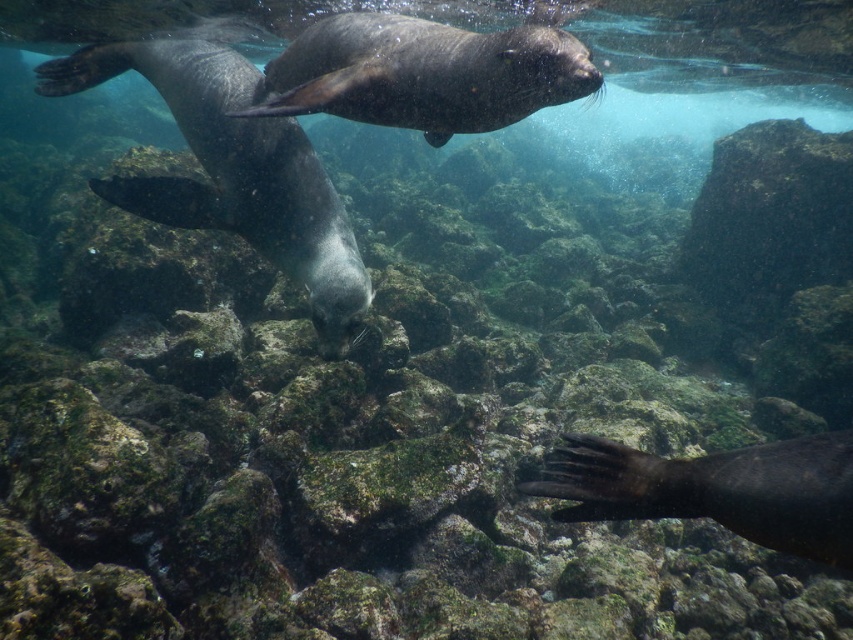
Consider the image. Is shiny dark fur seal at upper center above green mossy rock at upper right?

No, shiny dark fur seal at upper center is not above green mossy rock at upper right.

In the scene shown: Is shiny dark fur seal at upper center further to the viewer compared to green mossy rock at upper right?

No, it is in front of green mossy rock at upper right.

Is point (495, 33) positioned in front of point (801, 128)?

That is True.

What are the coordinates of `shiny dark fur seal at upper center` in the screenshot? It's located at (422, 74).

What do you see at coordinates (234, 172) in the screenshot?
I see `shiny gray seal at center` at bounding box center [234, 172].

Who is higher up, shiny gray seal at center or green mossy rock at upper right?

green mossy rock at upper right is higher up.

This screenshot has height=640, width=853. What do you see at coordinates (234, 172) in the screenshot?
I see `shiny gray seal at center` at bounding box center [234, 172].

At what (x,y) coordinates should I click in order to perform the action: click on shiny gray seal at center. Please return your answer as a coordinate pair (x, y). The height and width of the screenshot is (640, 853). Looking at the image, I should click on pyautogui.click(x=234, y=172).

Can you confirm if green mossy rock at upper right is thinner than dark gray fur seal at lower right?

In fact, green mossy rock at upper right might be wider than dark gray fur seal at lower right.

Which is behind, point (775, 134) or point (831, 518)?

Point (775, 134)

Locate an element on the screen. The width and height of the screenshot is (853, 640). green mossy rock at upper right is located at coordinates (770, 218).